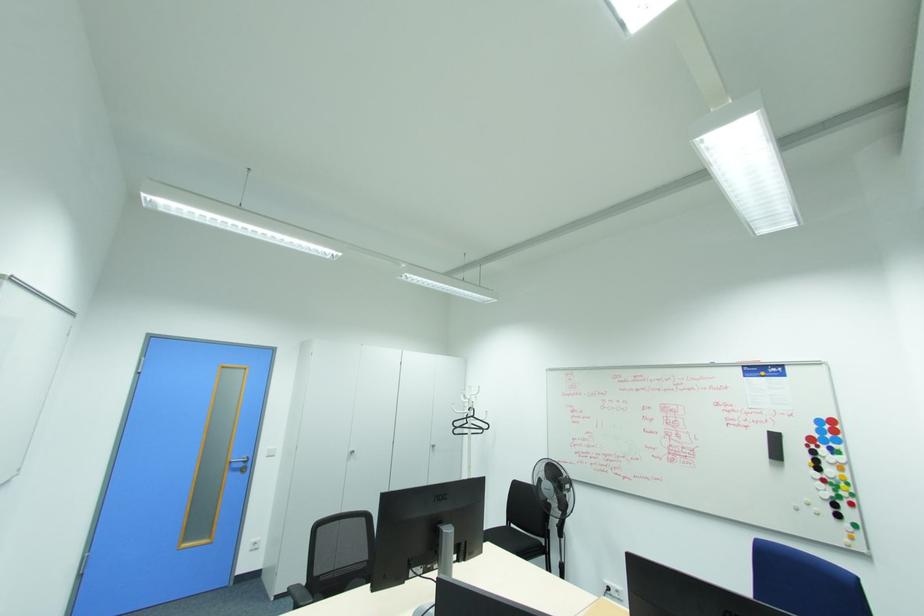
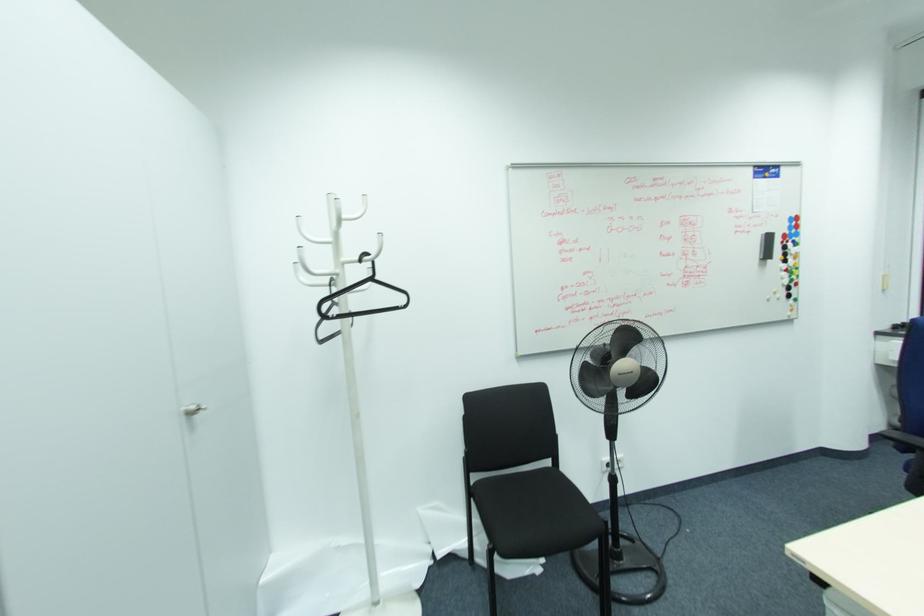
The point at (473, 416) is marked in the first image. Where is the corresponding point in the second image?

(371, 280)